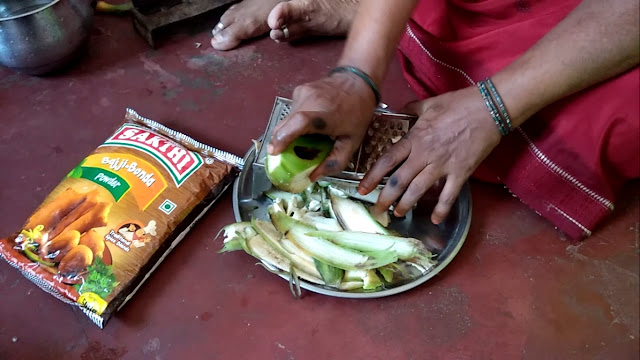
This screenshot has height=360, width=640. Identify the location of plate. (445, 259).